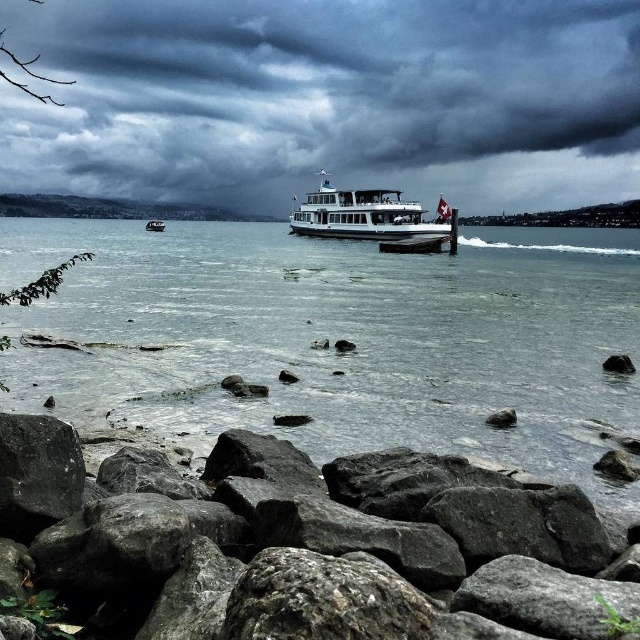
Based on the scene description, where is the clear water at lower left located in the image?

The clear water at lower left is located at point coordinates of (340,337).

You are a photographer standing on the lakeside and want to capture the wooden boat at center and the clear water at lower left in your shot. Which object will appear larger in your photo?

The clear water at lower left appears larger in the photo because it is taller than the wooden boat at center.